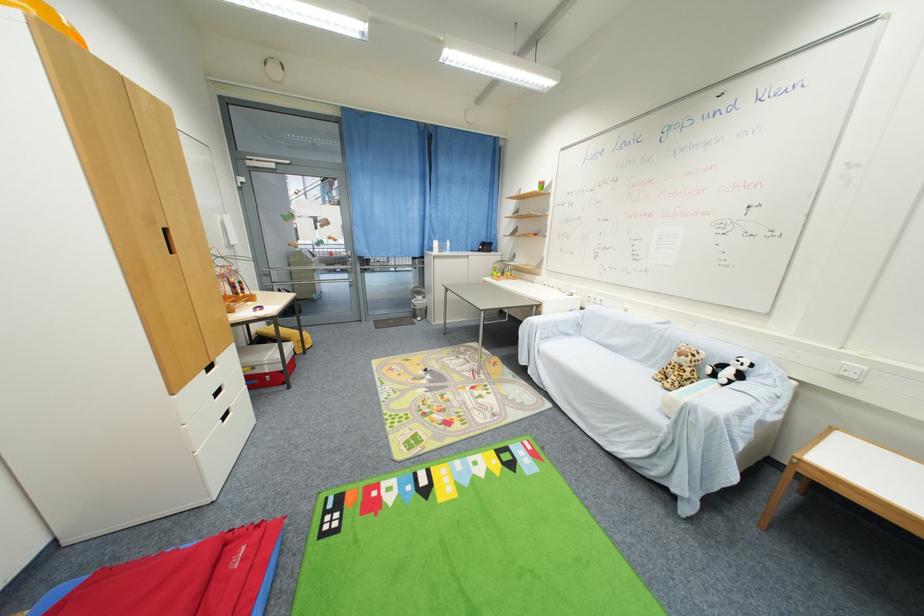
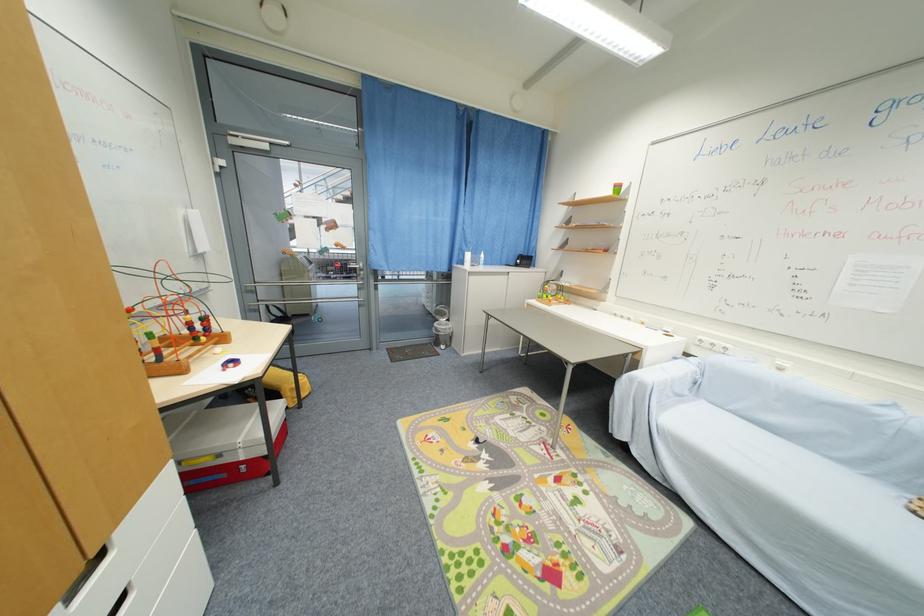
Find the pixel in the second image that matches (436,251) in the first image.

(467, 264)